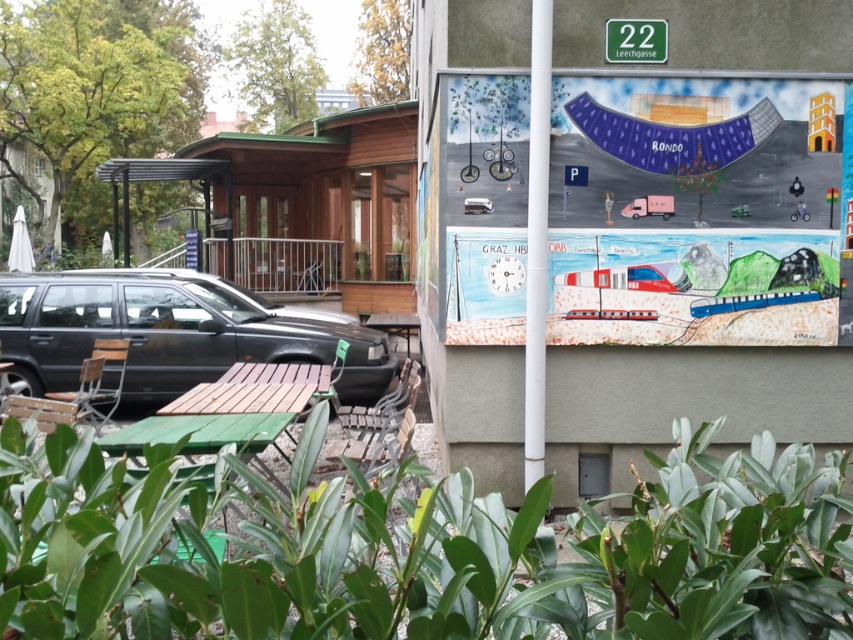
Can you confirm if matte black car at lower left is positioned to the left of green plastic street sign at upper center?

Correct, you'll find matte black car at lower left to the left of green plastic street sign at upper center.

Is point (90, 330) in front of point (650, 48)?

No, (90, 330) is behind (650, 48).

Locate an element on the screen. This screenshot has width=853, height=640. matte black car at lower left is located at coordinates (167, 333).

Can you confirm if watercolor painting of train at upper right is wider than matte black car at lower left?

No.

The width and height of the screenshot is (853, 640). Find the location of `watercolor painting of train at upper right`. watercolor painting of train at upper right is located at coordinates (698, 211).

The image size is (853, 640). What do you see at coordinates (379, 426) in the screenshot?
I see `metallic silver bench at center` at bounding box center [379, 426].

Does point (341, 440) come farther from viewer compared to point (622, 49)?

Yes, point (341, 440) is farther from viewer.

This screenshot has height=640, width=853. Identify the location of metallic silver bench at center. (379, 426).

Locate an element on the screen. The height and width of the screenshot is (640, 853). metallic silver bench at center is located at coordinates (379, 426).